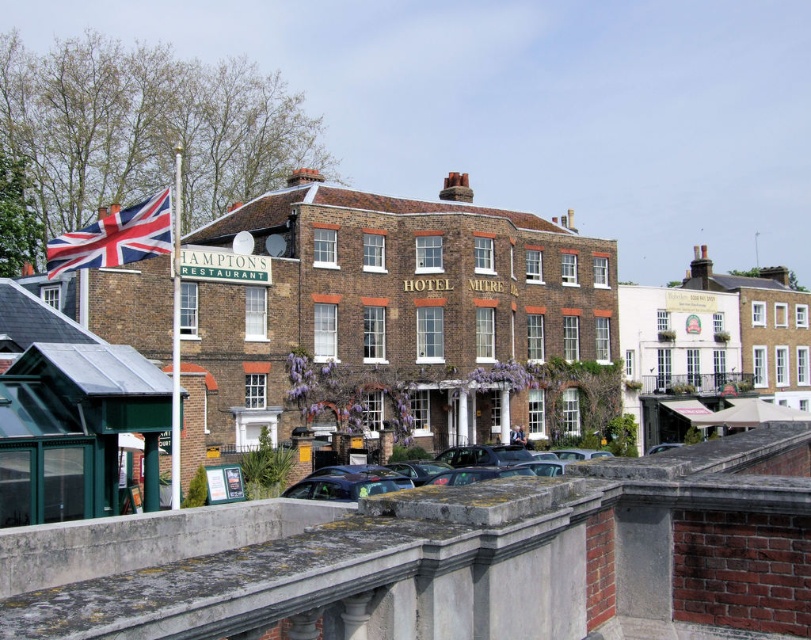
You are an architect analyzing the spatial layout of the urban scene. You notice the white brick building at upper right and the union jack fabric at upper left. Which object occupies a greater horizontal space in the image?

The white brick building at upper right occupies a greater horizontal space in the image because its width is larger than that of the union jack fabric at upper left.

You are a tourist standing in front of the HOTEL MITRE. You see a white painted building at upper right and a metallic gray car at center. Which object is higher up in the image?

The white painted building at upper right is located above the metallic gray car at center, so it is higher up in the image.